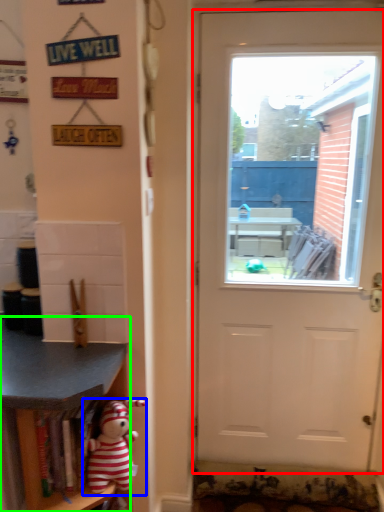
Question: Considering the real-world distances, which object is farthest from door (highlighted by a red box)? toy (highlighted by a blue box) or shelf (highlighted by a green box)?

Choices:
 (A) toy
 (B) shelf

Answer: (A)